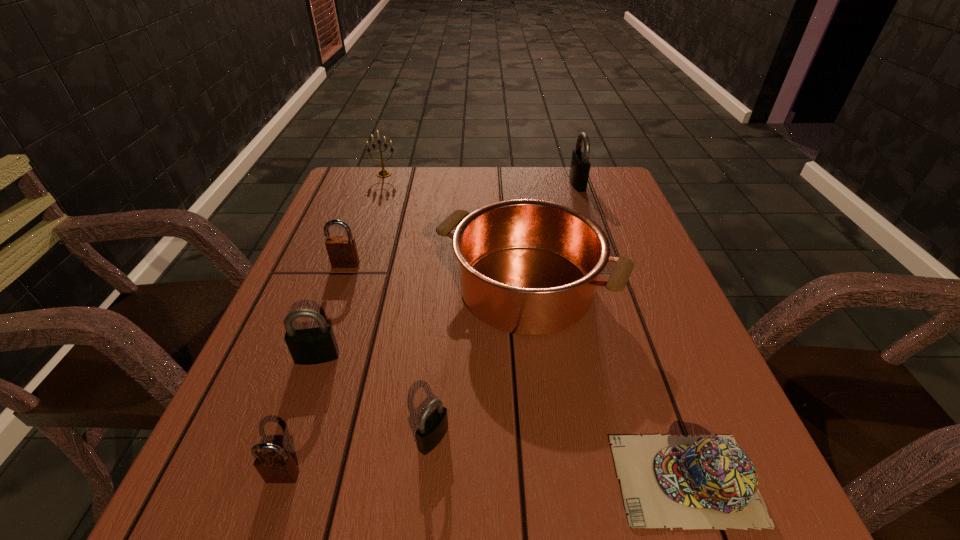
In the image, there is a desktop. Identify the location of vacant space at the far right corner. (613, 176).

Find the location of a particular element. vacant space that's between the bigger brown padlock and the second farthest black padlock is located at coordinates (331, 311).

This screenshot has height=540, width=960. I want to click on free space between the fifth farthest object and the smaller brown padlock, so click(300, 417).

At what (x,y) coordinates should I click in order to perform the action: click on unoccupied area between the fifth farthest object and the saucepan. Please return your answer as a coordinate pair (x, y). Image resolution: width=960 pixels, height=540 pixels. Looking at the image, I should click on (421, 323).

Where is `vacant space that is in between the saucepan and the shortest object`? The width and height of the screenshot is (960, 540). vacant space that is in between the saucepan and the shortest object is located at coordinates (606, 384).

Where is `free point between the nearest black padlock and the nearest padlock`? Image resolution: width=960 pixels, height=540 pixels. free point between the nearest black padlock and the nearest padlock is located at coordinates (358, 457).

This screenshot has height=540, width=960. I want to click on vacant space that's between the shortest object and the saucepan, so click(606, 384).

This screenshot has width=960, height=540. I want to click on empty location between the saucepan and the shortest object, so click(x=606, y=384).

At what (x,y) coordinates should I click in order to perform the action: click on blank region between the rightmost black padlock and the shortest object. Please return your answer as a coordinate pair (x, y). The width and height of the screenshot is (960, 540). Looking at the image, I should click on (632, 332).

What are the coordinates of `object that can be found as the fourth closest to the saucepan` in the screenshot? It's located at (700, 482).